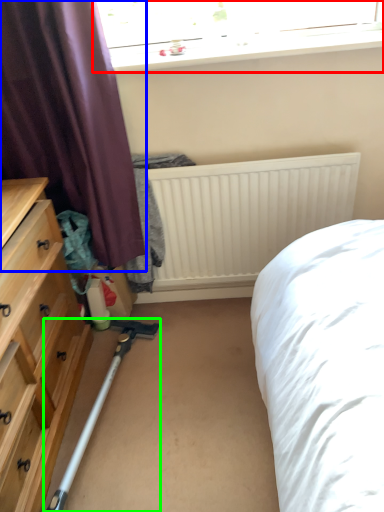
Question: Considering the real-world distances, which object is farthest from window (highlighted by a red box)? curtain (highlighted by a blue box) or equipment (highlighted by a green box)?

Choices:
 (A) curtain
 (B) equipment

Answer: (B)